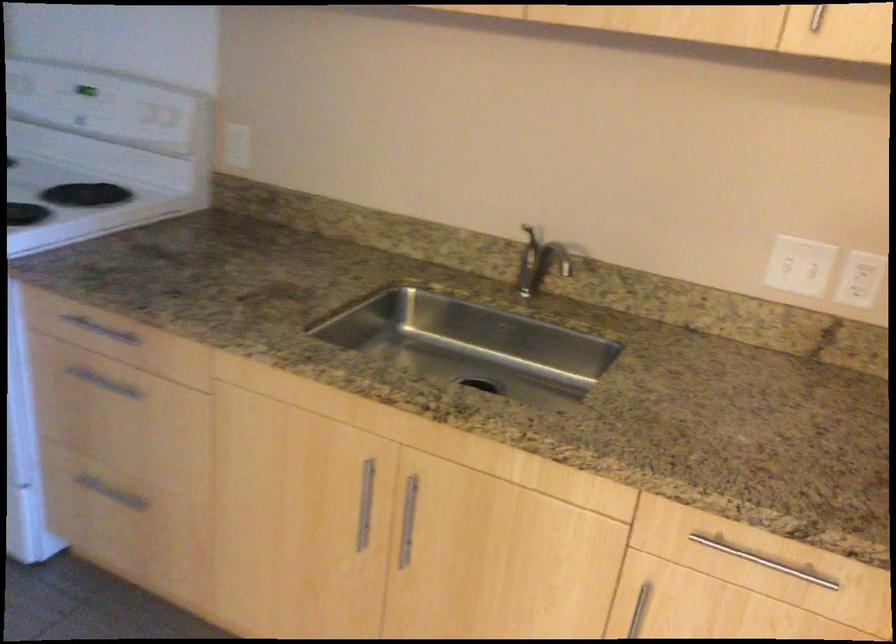
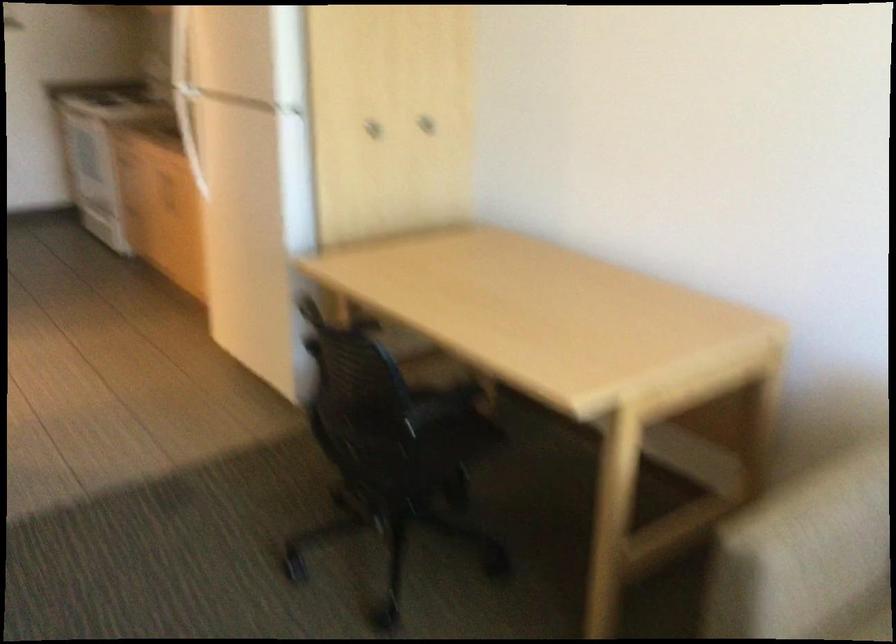
Question: I am providing you with two images of the same scene from different viewpoints. Which of the following objects are not visible in image2?

Choices:
 (A) black electric device
 (B) cabinet door knob
 (C) refrigerator door handle
 (D) faucet handle

Answer: (D)